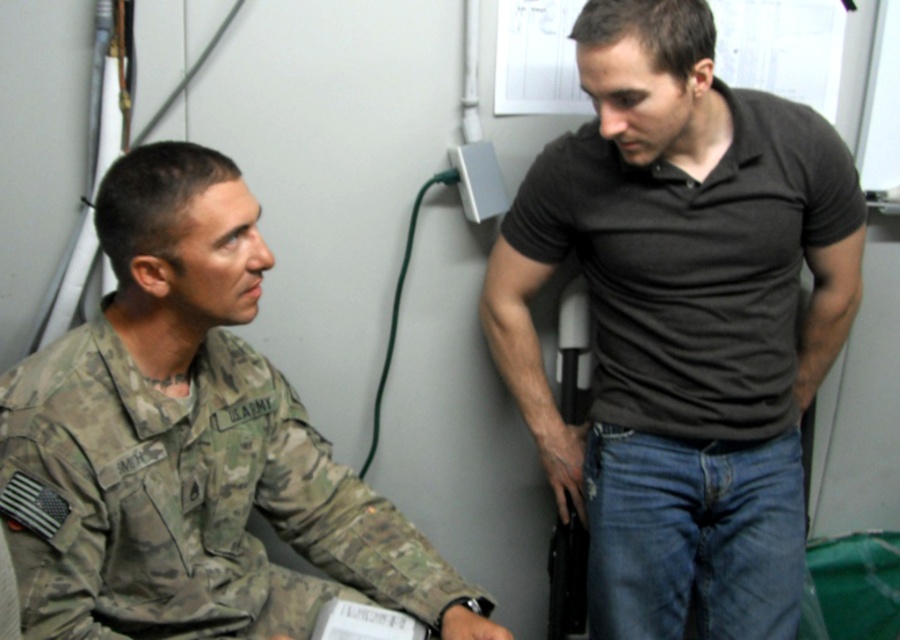
Question: Is black cotton shirt at center smaller than camouflage uniform at left?

Choices:
 (A) yes
 (B) no

Answer: (B)

Question: Is black cotton shirt at center to the right of camouflage uniform at left from the viewer's perspective?

Choices:
 (A) no
 (B) yes

Answer: (B)

Question: Which point is farther to the camera?

Choices:
 (A) black cotton shirt at center
 (B) camouflage uniform at left

Answer: (A)

Question: Does black cotton shirt at center appear on the left side of camouflage uniform at left?

Choices:
 (A) no
 (B) yes

Answer: (A)

Question: Which object appears closest to the camera in this image?

Choices:
 (A) black cotton shirt at center
 (B) camouflage uniform at left

Answer: (B)

Question: Among these points, which one is farthest from the camera?

Choices:
 (A) (640, 336)
 (B) (180, 243)

Answer: (A)